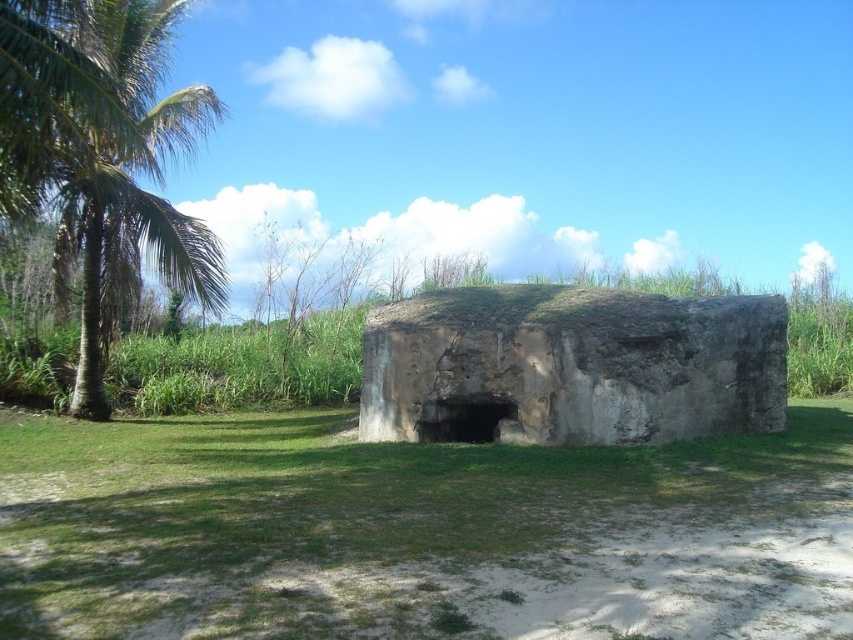
Is point (616, 314) closer to camera compared to point (7, 64)?

That is False.

Consider the image. Can you confirm if gray stone bunker at center is wider than green leafy palm at left?

Yes.

Is point (701, 397) closer to viewer compared to point (146, 161)?

Yes, point (701, 397) is closer to viewer.

Locate an element on the screen. Image resolution: width=853 pixels, height=640 pixels. gray stone bunker at center is located at coordinates (572, 365).